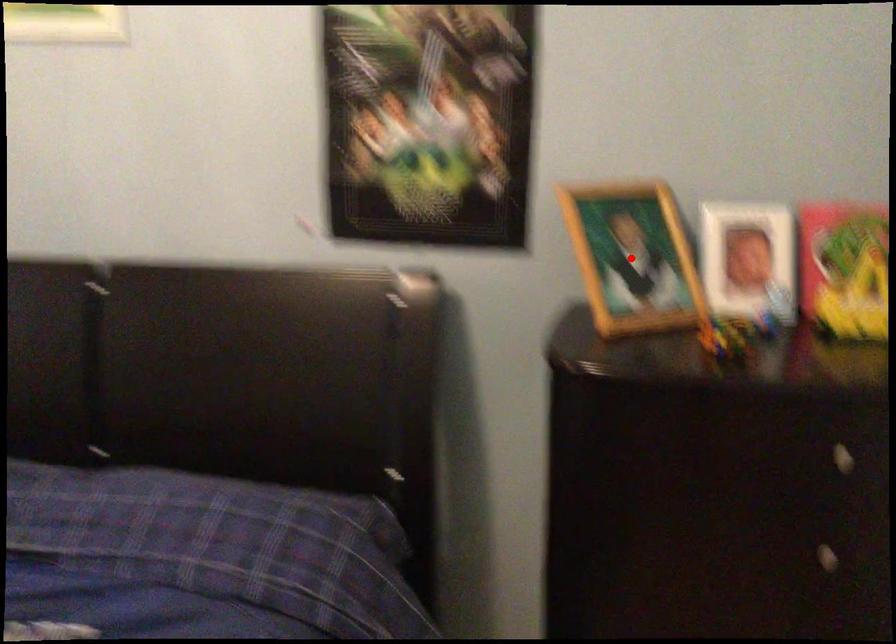
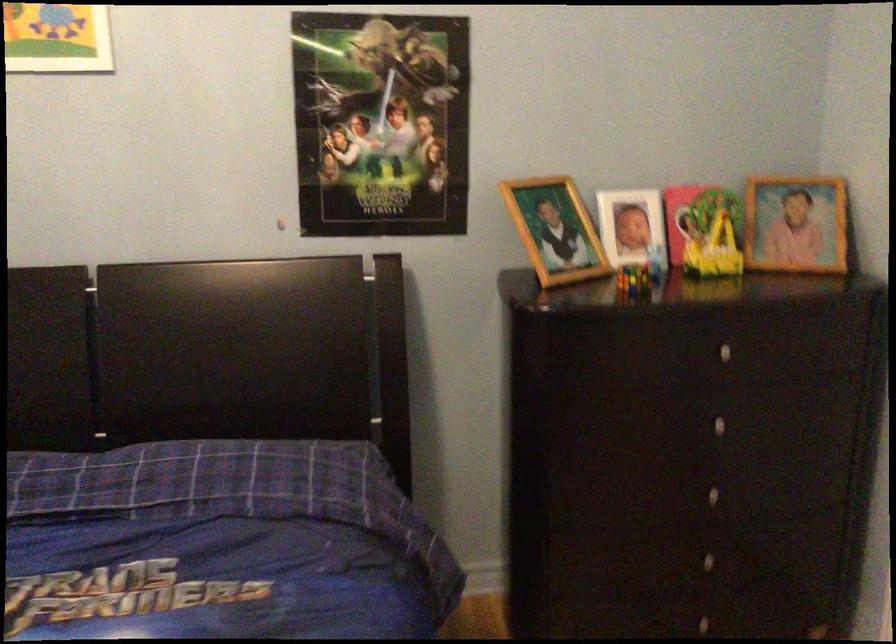
Question: I am providing you with two images of the same scene from different viewpoints. A red point is marked on the first image. Can you still see the location of the red point in image 2?

Choices:
 (A) Yes
 (B) No

Answer: (A)